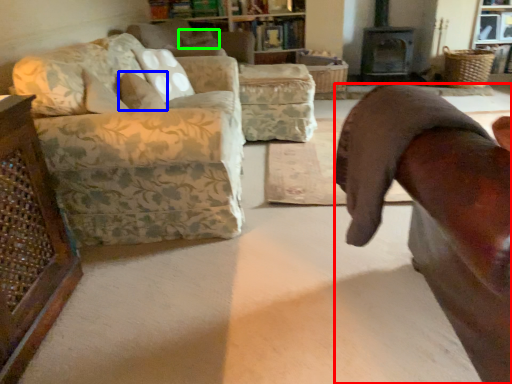
Question: Which is farther away from chair (highlighted by a red box)? pillow (highlighted by a blue box) or pillow (highlighted by a green box)?

Choices:
 (A) pillow
 (B) pillow

Answer: (B)